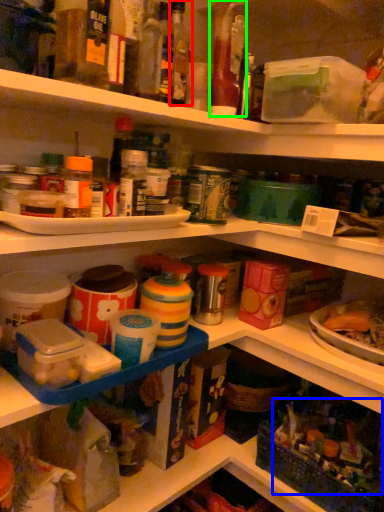
Question: Which is farther away from bottle (highlighted by a red box)? food (highlighted by a blue box) or bottle (highlighted by a green box)?

Choices:
 (A) food
 (B) bottle

Answer: (A)